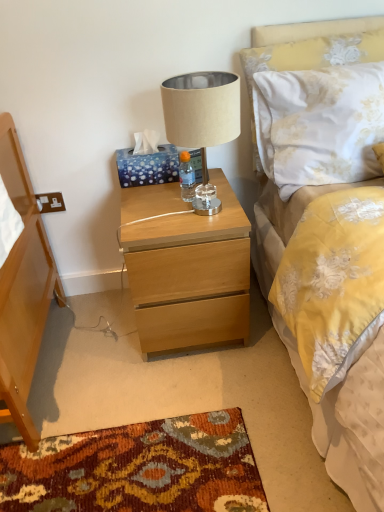
Question: Is white floral fabric pillow at upper right spatially inside light wood nightstand at center, or outside of it?

Choices:
 (A) inside
 (B) outside

Answer: (B)

Question: From the image's perspective, is white floral fabric pillow at upper right above or below light wood nightstand at center?

Choices:
 (A) above
 (B) below

Answer: (A)

Question: Which object is positioned farthest from the beige fabric lampshade at center?

Choices:
 (A) clear plastic bottle at center
 (B) white floral fabric pillow at upper right
 (C) light wood nightstand at center

Answer: (C)

Question: Estimate the real-world distances between objects in this image. Which object is closer to the beige fabric lampshade at center?

Choices:
 (A) white floral fabric pillow at upper right
 (B) clear plastic bottle at center
 (C) light wood nightstand at center

Answer: (A)